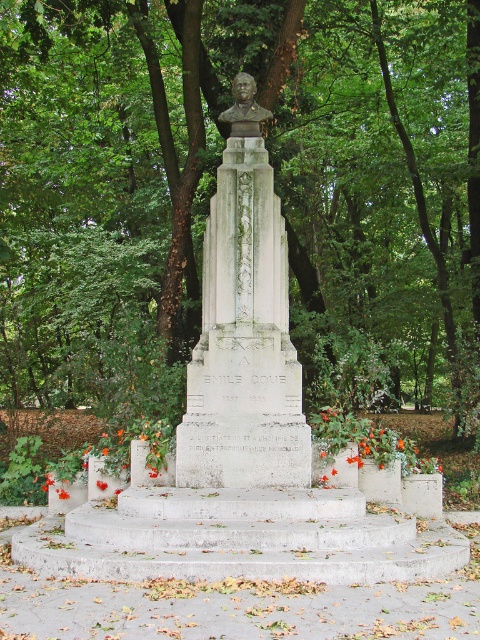
Question: Can you confirm if orange fabric flower at lower center is thinner than orange matte flower at lower center?

Choices:
 (A) no
 (B) yes

Answer: (A)

Question: Among these points, which one is farthest from the camera?

Choices:
 (A) (252, 112)
 (B) (103, 481)

Answer: (A)

Question: Which point is closer to the camera?

Choices:
 (A) green leafy tree at center
 (B) orange fabric flower at lower center

Answer: (B)

Question: Which point is closer to the camera?

Choices:
 (A) green leafy tree at center
 (B) orange fabric flower at center

Answer: (B)

Question: Does matte bronze bust at center lie behind orange fabric flower at center?

Choices:
 (A) no
 (B) yes

Answer: (B)

Question: Does orange fabric flower at center appear on the right side of orange matte flower at lower center?

Choices:
 (A) yes
 (B) no

Answer: (B)